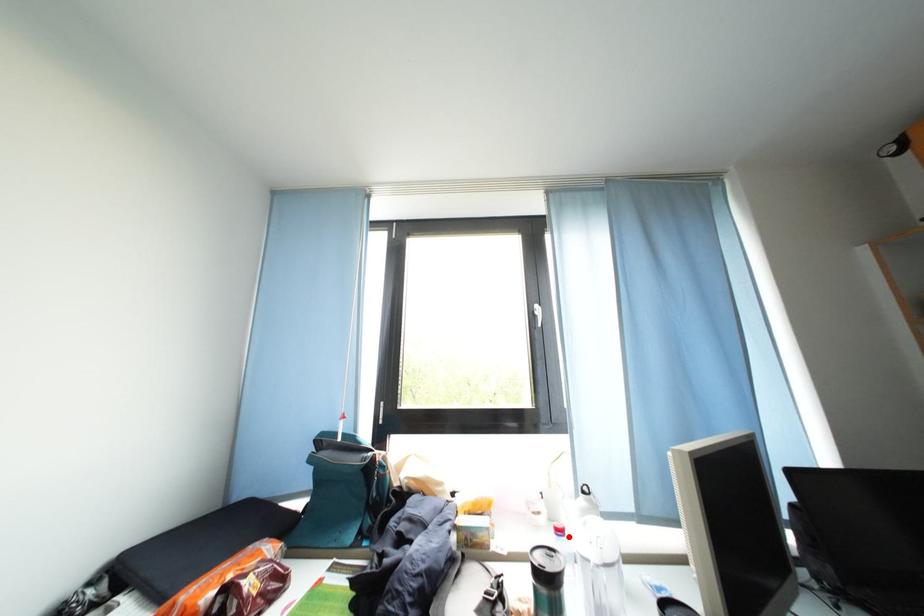
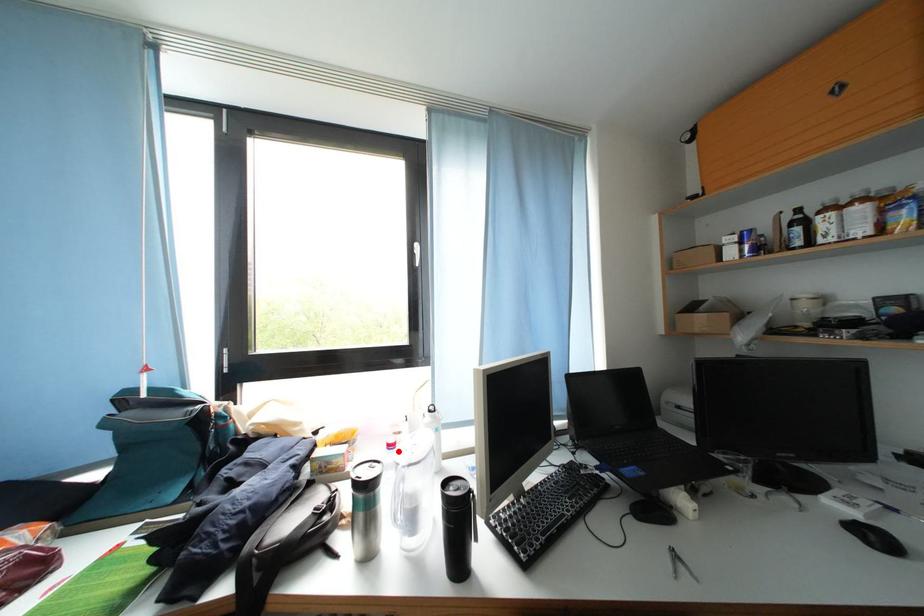
I am providing you with two images of the same scene from different viewpoints. A red point is marked on the first image and another point is marked on the second image. Is the marked point in image1 the same physical position as the marked point in image2?

Yes